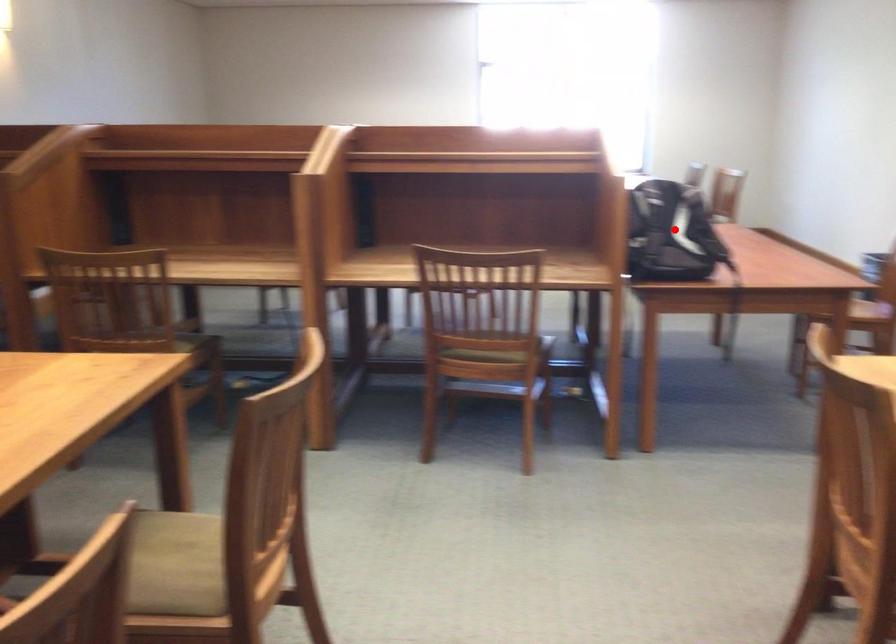
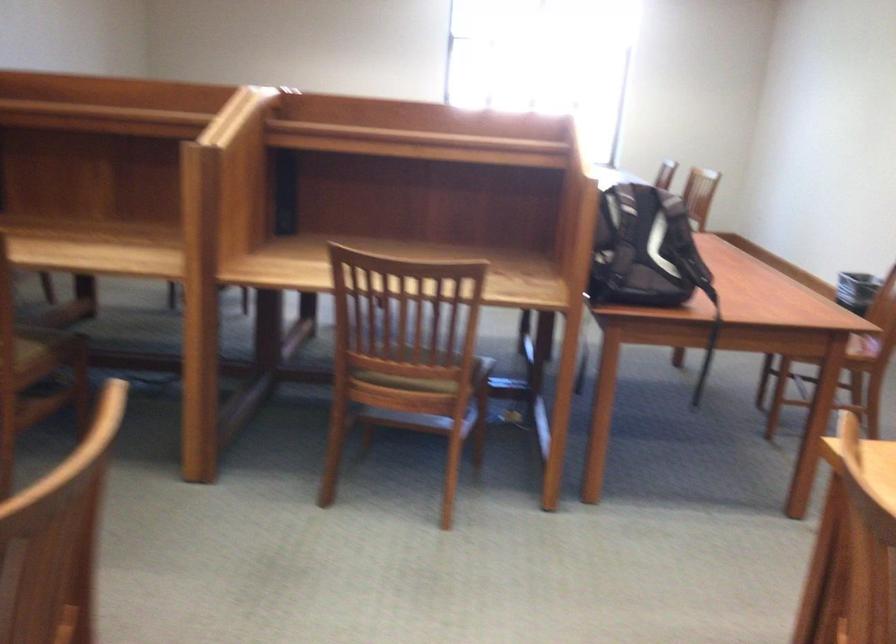
Question: I am providing you with two images of the same scene from different viewpoints. In image1, a red point is highlighted. Considering the same 3D point in image2, which of the following is correct?

Choices:
 (A) It is closer
 (B) It is farther

Answer: (A)